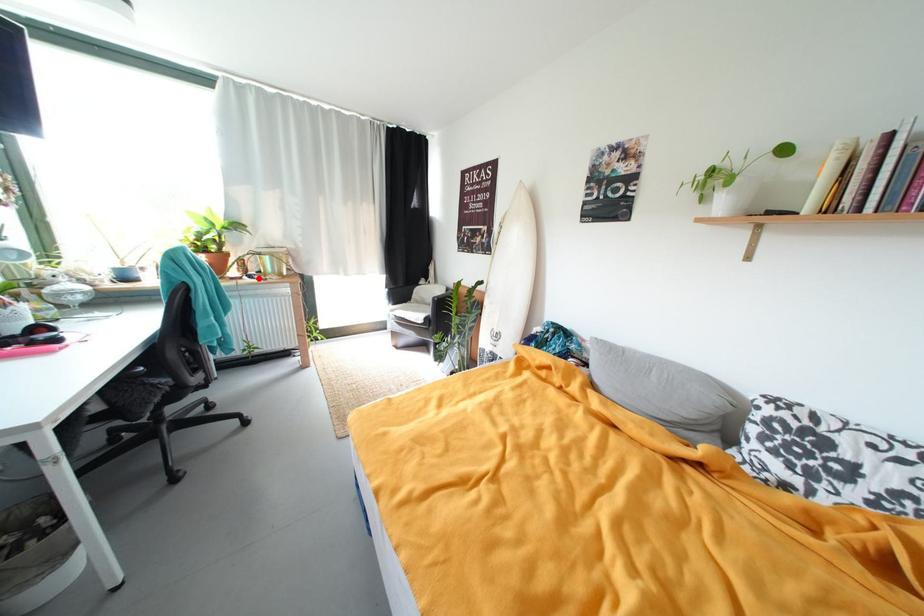
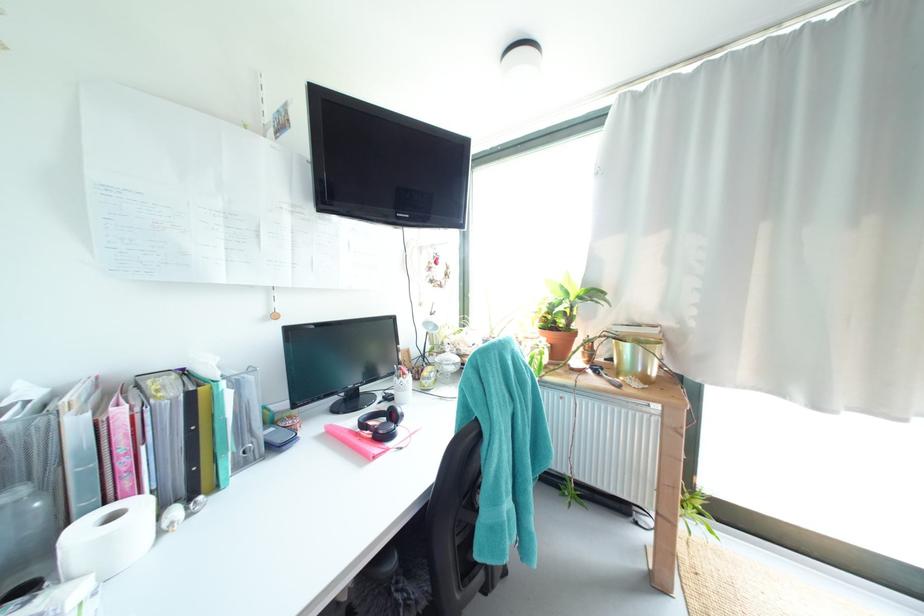
Find the pixel in the second image that matches the highlighted location in the first image.

(603, 373)